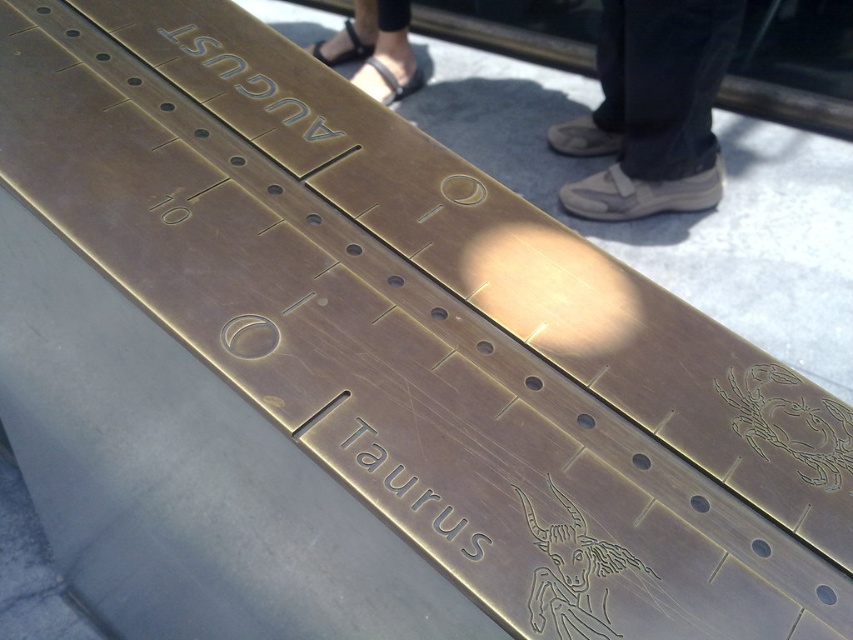
Describe the element at coordinates (653, 109) in the screenshot. This screenshot has width=853, height=640. I see `dark brown leather shoe at upper center` at that location.

What do you see at coordinates (653, 109) in the screenshot? The image size is (853, 640). I see `dark brown leather shoe at upper center` at bounding box center [653, 109].

Image resolution: width=853 pixels, height=640 pixels. I want to click on dark brown leather shoe at upper center, so click(653, 109).

How distant is dark brown leather shoe at upper center from black leather sandals at upper center?

dark brown leather shoe at upper center is 34.49 inches from black leather sandals at upper center.

Does dark brown leather shoe at upper center appear over black leather sandals at upper center?

No, dark brown leather shoe at upper center is not above black leather sandals at upper center.

Between point (706, 38) and point (408, 42), which one is positioned in front?

Point (706, 38)

This screenshot has height=640, width=853. Find the location of `dark brown leather shoe at upper center`. dark brown leather shoe at upper center is located at coordinates (653, 109).

Which of these two, gray fabric shoe at upper right or black leather sandals at upper center, stands taller?

With more height is gray fabric shoe at upper right.

Does gray fabric shoe at upper right appear under black leather sandals at upper center?

Yes, gray fabric shoe at upper right is below black leather sandals at upper center.

Does point (674, 56) lie behind point (389, 28)?

That is False.

Find the location of a particular element. The height and width of the screenshot is (640, 853). gray fabric shoe at upper right is located at coordinates click(x=653, y=109).